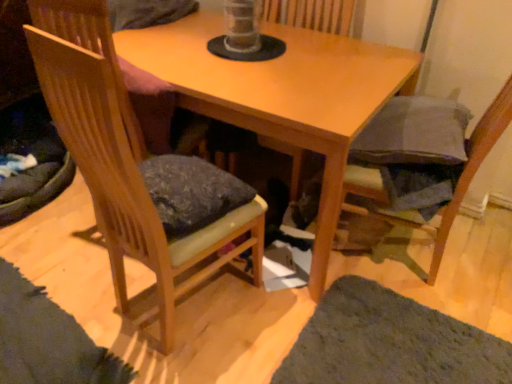
Image resolution: width=512 pixels, height=384 pixels. I want to click on vacant space underneath dark gray fabric cushion at lower right, acting as the 2th chair starting from the left (from a real-world perspective), so (412, 258).